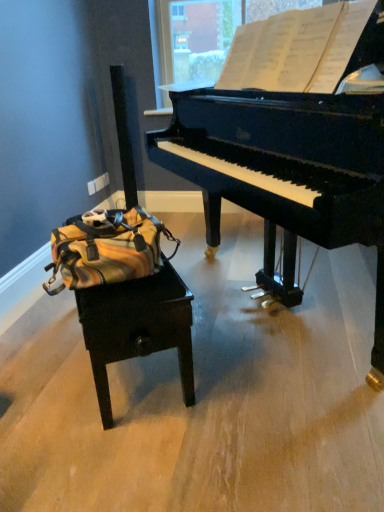
Question: Is white paper at upper center wider than yellow striped fabric messenger bag at left?

Choices:
 (A) no
 (B) yes

Answer: (A)

Question: Is white paper at upper center to the left of yellow striped fabric messenger bag at left from the viewer's perspective?

Choices:
 (A) no
 (B) yes

Answer: (A)

Question: Is white paper at upper center positioned with its back to yellow striped fabric messenger bag at left?

Choices:
 (A) yes
 (B) no

Answer: (B)

Question: Would you say white paper at upper center is outside yellow striped fabric messenger bag at left?

Choices:
 (A) no
 (B) yes

Answer: (B)

Question: From the image's perspective, is white paper at upper center on yellow striped fabric messenger bag at left?

Choices:
 (A) yes
 (B) no

Answer: (A)

Question: Looking at their shapes, would you say white paper at upper center is wider or thinner than wooden table at lower left?

Choices:
 (A) wide
 (B) thin

Answer: (B)

Question: Relative to wooden table at lower left, is white paper at upper center in front or behind?

Choices:
 (A) front
 (B) behind

Answer: (A)

Question: From a real-world perspective, is white paper at upper center physically located above or below wooden table at lower left?

Choices:
 (A) above
 (B) below

Answer: (A)

Question: Based on their sizes in the image, would you say white paper at upper center is bigger or smaller than wooden table at lower left?

Choices:
 (A) small
 (B) big

Answer: (A)

Question: In terms of height, does yellow striped fabric messenger bag at left look taller or shorter compared to white paper at upper center?

Choices:
 (A) short
 (B) tall

Answer: (A)

Question: Visually, is yellow striped fabric messenger bag at left positioned to the left or to the right of white paper at upper center?

Choices:
 (A) left
 (B) right

Answer: (A)

Question: Considering their positions, is yellow striped fabric messenger bag at left located in front of or behind white paper at upper center?

Choices:
 (A) behind
 (B) front

Answer: (B)

Question: Looking at their shapes, would you say yellow striped fabric messenger bag at left is wider or thinner than white paper at upper center?

Choices:
 (A) wide
 (B) thin

Answer: (A)

Question: Would you say black polished piano at upper right is to the left or to the right of yellow striped fabric messenger bag at left in the picture?

Choices:
 (A) right
 (B) left

Answer: (A)

Question: From the image's perspective, relative to yellow striped fabric messenger bag at left, is black polished piano at upper right above or below?

Choices:
 (A) above
 (B) below

Answer: (A)